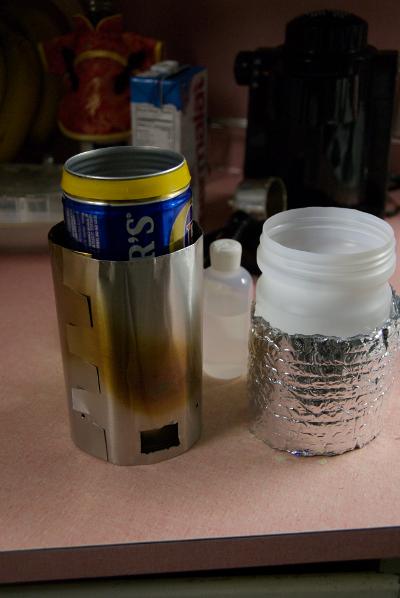
At what (x,y) coordinates should I click in order to perform the action: click on side of table top. Please return your answer as a coordinate pair (x, y). The width and height of the screenshot is (400, 598). Looking at the image, I should click on (243, 551).